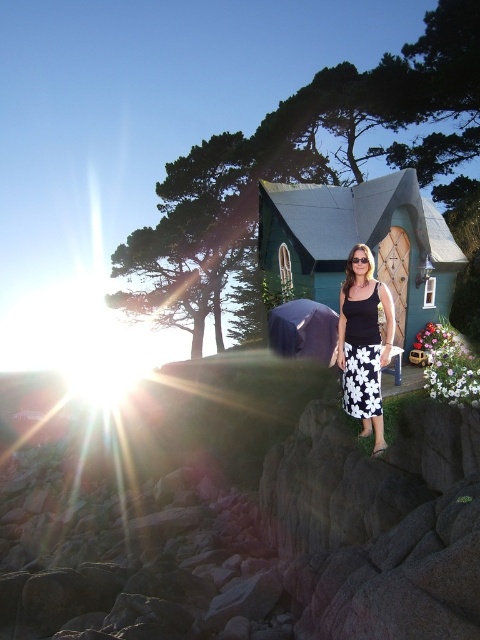
You are a photographer setting up a tripod to capture the scene. The tripod requires a stable surface that is at least 1.2 meters tall. Given the gray rock at lower center and the black floral skirt at center, which object can provide a stable base for the tripod?

The gray rock at lower center has a greater height compared to the black floral skirt at center, so it can provide a stable base for the tripod since it meets the height requirement of 1.2 meters.

You are a photographer setting up a tripod to capture the scene. The tripod requires a stable surface wider than the object it will hold. If you want to place it on the gray rock at lower center or the black floral skirt at center, which surface is suitable?

The gray rock at lower center has a greater width than the black floral skirt at center, so it is the suitable surface for placing the tripod.

You are standing at the point marked by the coordinates point (245,518) in the image. What object are you standing on?

You are standing on the gray rock at lower center, which is represented by the coordinates point (245,518).